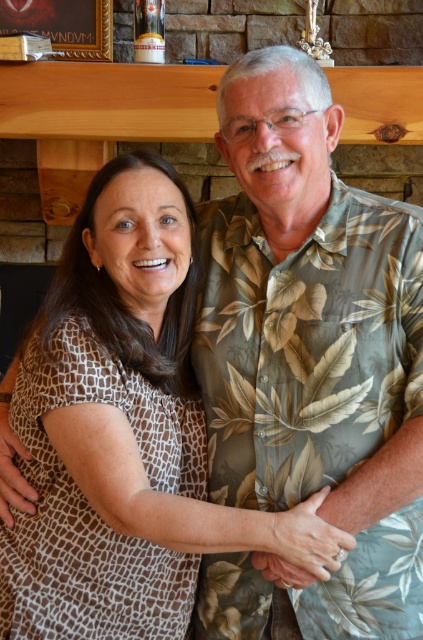
You are standing in the living room and want to place a small decorative item on one of two specific points on the mantelpiece. The first point is at coordinates point (156, 600) and the second is at point (52, 44). Which point is closer to you?

Point (156, 600) is closer to the viewer than point (52, 44), so you should place the item there if you want it nearer to your current position.

You are taking a photo of the brown textured blouse at center and the wooden picture frame at upper center. Which object is positioned closer to the camera?

The brown textured blouse at center is closer to the viewer than the wooden picture frame at upper center, so the blouse is positioned closer to the camera.

You are a photographer setting up a shot of the two people in the scene. You want to ensure that the brown textured blouse at center and the wooden picture frame at upper center are visible in the frame. Based on their positions, which object is closer to the bottom of the image?

The brown textured blouse at center is below the wooden picture frame at upper center, so the brown textured blouse at center is closer to the bottom of the image.